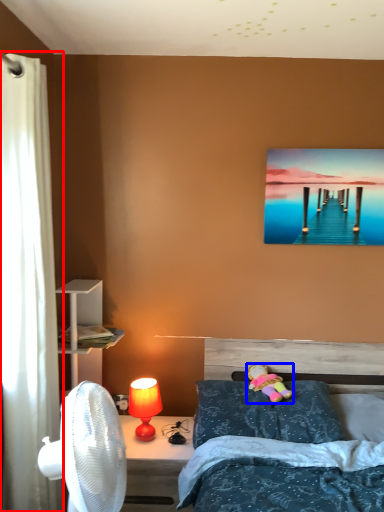
Question: Which object is further to the camera taking this photo, curtain (highlighted by a red box) or toy (highlighted by a blue box)?

Choices:
 (A) curtain
 (B) toy

Answer: (B)